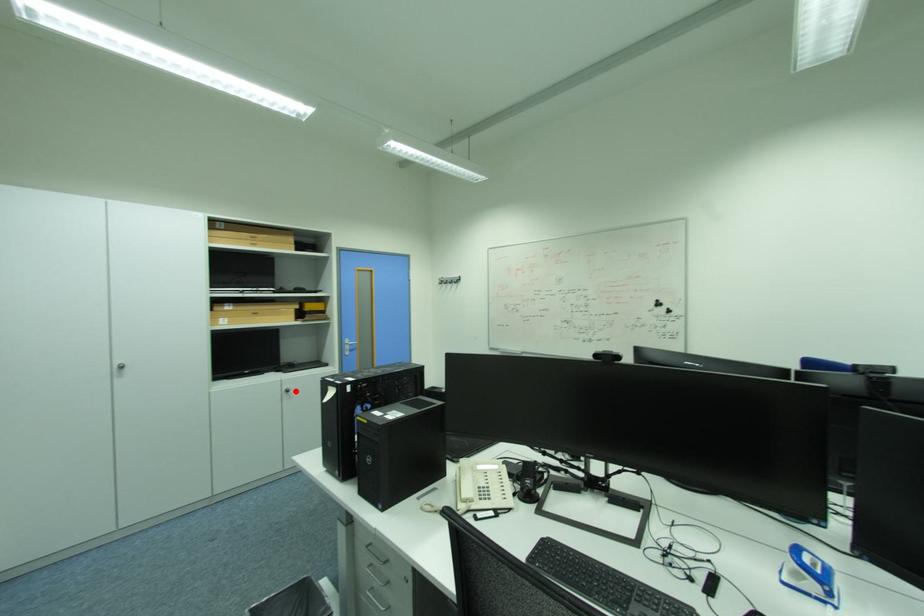
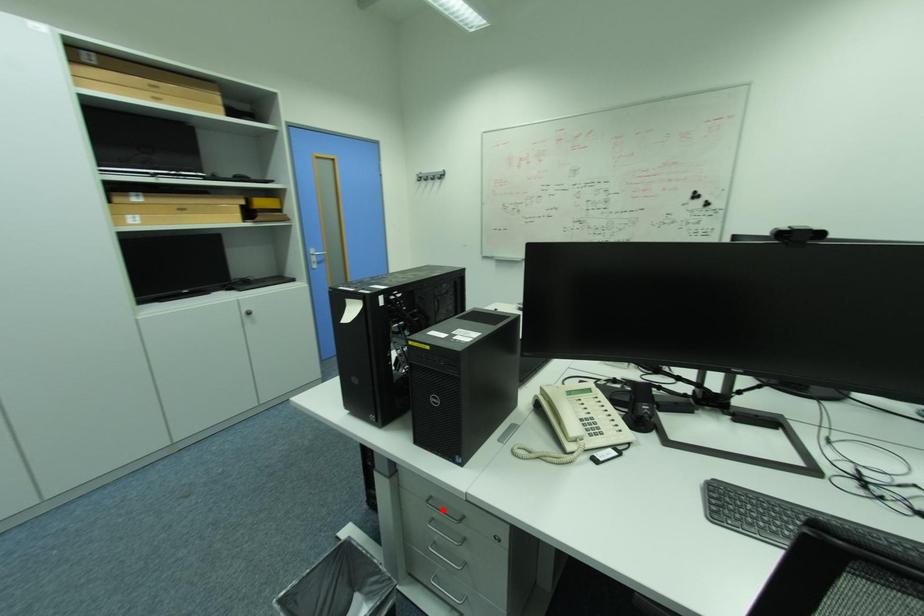
I am providing you with two images of the same scene from different viewpoints. A red point is marked on the first image and another point is marked on the second image. Are the points marked in image1 and image2 representing the same 3D position?

No